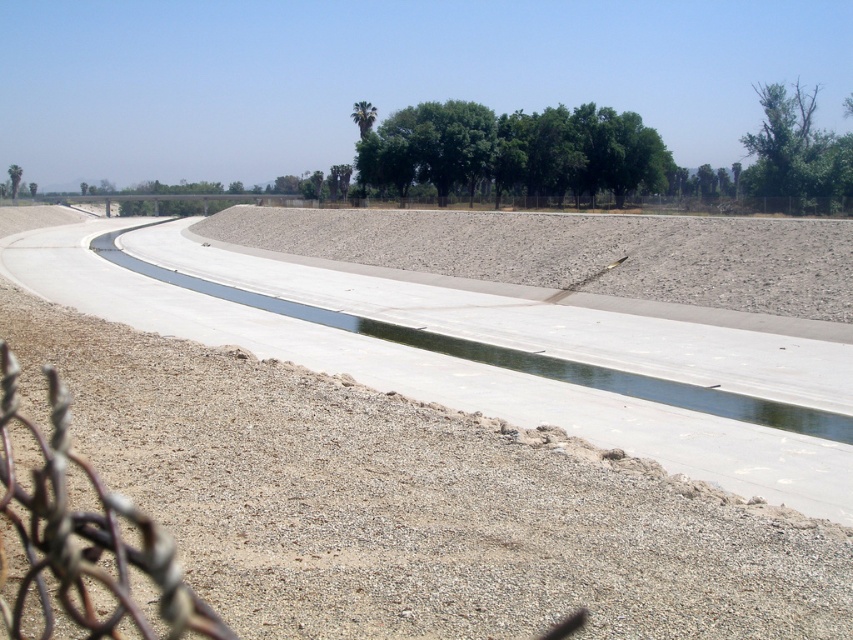
Which is more to the left, green leafy trees at center or green leafy tree at upper center?

From the viewer's perspective, green leafy tree at upper center appears more on the left side.

Does green leafy trees at center have a lesser width compared to green leafy tree at upper center?

No.

Does point (561, 164) lie in front of point (10, 168)?

That is True.

Where is `green leafy trees at center`? The width and height of the screenshot is (853, 640). green leafy trees at center is located at coordinates (x=514, y=150).

Measure the distance from gray gravel dirt field at center to green leafy tree at upper center.

The distance of gray gravel dirt field at center from green leafy tree at upper center is 152.78 meters.

Between gray gravel dirt field at center and green leafy tree at upper center, which one appears on the left side from the viewer's perspective?

Positioned to the left is green leafy tree at upper center.

Between point (439, 602) and point (19, 168), which one is positioned in front?

Point (439, 602) is more forward.

Where is `gray gravel dirt field at center`? gray gravel dirt field at center is located at coordinates point(412,504).

Can you confirm if green leafy tree at upper right is smaller than green leafy tree at upper center?

No, green leafy tree at upper right is not smaller than green leafy tree at upper center.

Does green leafy tree at upper right lie in front of green leafy tree at upper center?

Yes, green leafy tree at upper right is closer to the viewer.

Is point (785, 99) farther from viewer compared to point (10, 179)?

No, it is in front of (10, 179).

The height and width of the screenshot is (640, 853). I want to click on green leafy tree at upper right, so click(795, 148).